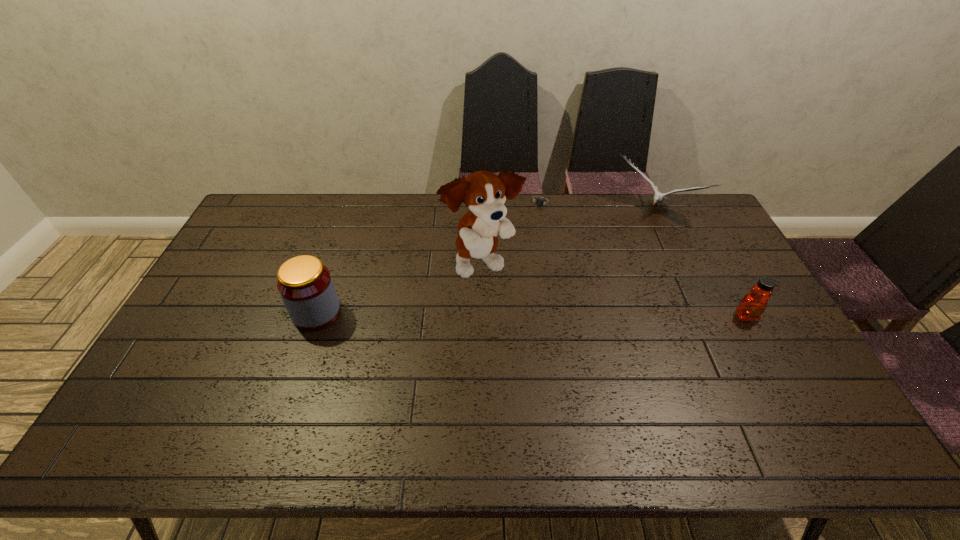
Find the location of a particular element. The width and height of the screenshot is (960, 540). the leftmost object is located at coordinates [x=305, y=285].

Find the location of `the second shortest object`. the second shortest object is located at coordinates (752, 306).

Locate an element on the screen. The height and width of the screenshot is (540, 960). the second object from left to right is located at coordinates tap(484, 193).

At what (x,y) coordinates should I click in order to perform the action: click on puppy. Please return your answer as a coordinate pair (x, y). This screenshot has height=540, width=960. Looking at the image, I should click on (484, 193).

Locate an element on the screen. The height and width of the screenshot is (540, 960). the third object from left to right is located at coordinates (539, 202).

I want to click on the shortest object, so click(539, 202).

The image size is (960, 540). In order to click on gull in this screenshot , I will do `click(658, 197)`.

At what (x,y) coordinates should I click in order to perform the action: click on vacant region located 0.230m on the back of the leftmost object. Please return your answer as a coordinate pair (x, y). The width and height of the screenshot is (960, 540). Looking at the image, I should click on coord(340,246).

You are a GUI agent. You are given a task and a screenshot of the screen. Output one action in this format:
    pyautogui.click(x=<x>, y=<y>)
    Task: Click on the vacant area situated 0.060m on the front label of the honey
    This screenshot has width=960, height=540.
    Given the screenshot: What is the action you would take?
    pyautogui.click(x=760, y=342)

You are a GUI agent. You are given a task and a screenshot of the screen. Output one action in this format:
    pyautogui.click(x=<x>, y=<y>)
    Task: Click on the vacant region located 0.250m on the face of the third farthest object
    This screenshot has height=540, width=960.
    Given the screenshot: What is the action you would take?
    pyautogui.click(x=562, y=336)